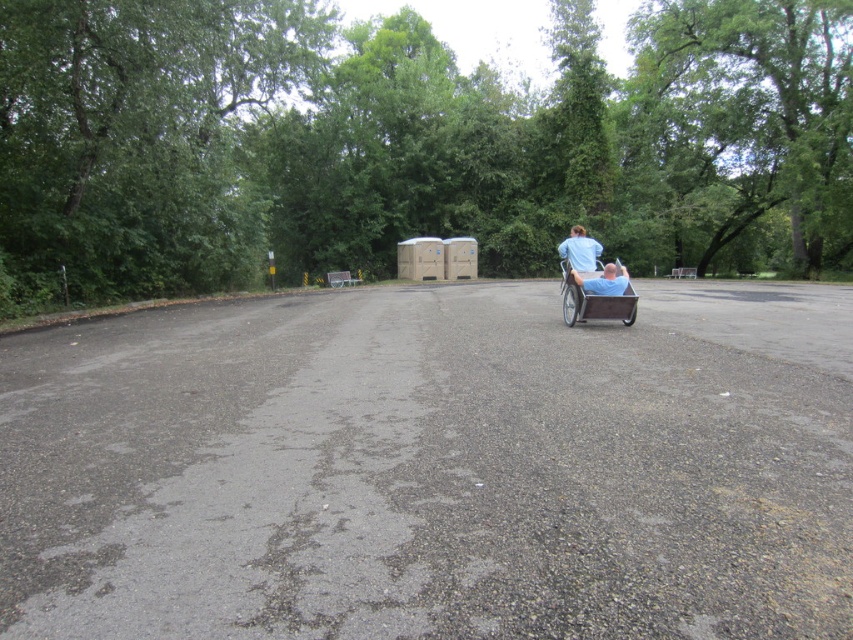
Is blue fabric shirt at center shorter than blue fabric person at center?

In fact, blue fabric shirt at center may be taller than blue fabric person at center.

Does blue fabric shirt at center appear over blue fabric person at center?

Indeed, blue fabric shirt at center is positioned over blue fabric person at center.

The width and height of the screenshot is (853, 640). Identify the location of blue fabric shirt at center. (579, 250).

Is wooden cart at right shorter than blue fabric person at center?

In fact, wooden cart at right may be taller than blue fabric person at center.

The image size is (853, 640). Find the location of `wooden cart at right`. wooden cart at right is located at coordinates (595, 301).

Which is in front, point (576, 285) or point (607, 280)?

Point (607, 280) is more forward.

Image resolution: width=853 pixels, height=640 pixels. Identify the location of wooden cart at right. (595, 301).

In the scene shown: Is wooden cart at right further to camera compared to blue fabric shirt at center?

No, wooden cart at right is closer to the viewer.

This screenshot has height=640, width=853. What do you see at coordinates (595, 301) in the screenshot?
I see `wooden cart at right` at bounding box center [595, 301].

Is point (596, 305) positioned after point (587, 262)?

No, it is in front of (587, 262).

Identify the location of wooden cart at right. The width and height of the screenshot is (853, 640). (595, 301).